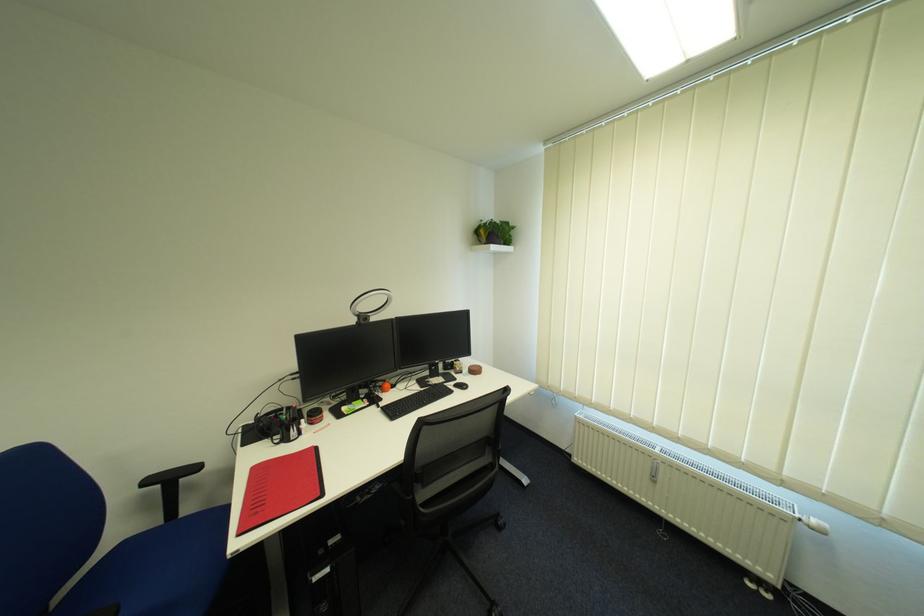
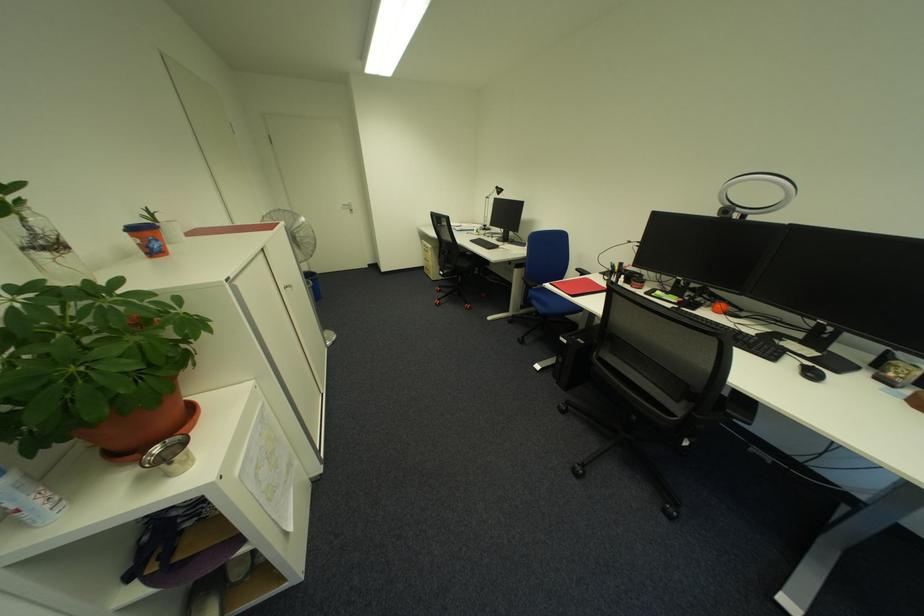
Where in the second image is the point corresponding to pixel 475 387 from the first image?

(820, 376)